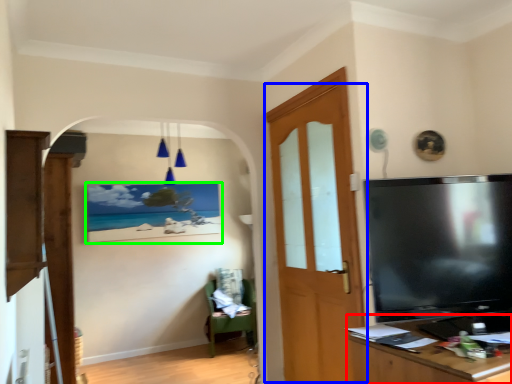
Question: Which object is the closest to the desk (highlighted by a red box)? Choose among these: door (highlighted by a blue box) or picture frame (highlighted by a green box).

Choices:
 (A) door
 (B) picture frame

Answer: (A)